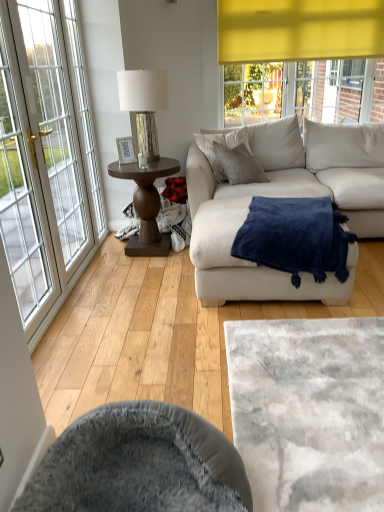
Question: Is navy blue plush blanket at center wider or thinner than velvet grey swivel chair at lower center?

Choices:
 (A) wide
 (B) thin

Answer: (A)

Question: Is point (284, 258) positioned closer to the camera than point (215, 482)?

Choices:
 (A) farther
 (B) closer

Answer: (A)

Question: Which object is positioned farthest from the white glass window at left?

Choices:
 (A) light brown wood flooring at center
 (B) textured gray pillow at center
 (C) velvet grey swivel chair at lower center
 (D) beige fabric couch at center
 (E) velvety gray cat bed at lower center

Answer: (E)

Question: Estimate the real-world distances between objects in this image. Which object is farther from the navy blue plush blanket at center?

Choices:
 (A) velvet grey swivel chair at lower center
 (B) beige fabric couch at center
 (C) white glass window at left
 (D) velvety gray cat bed at lower center
 (E) metallic silver table lamp at center left

Answer: (C)